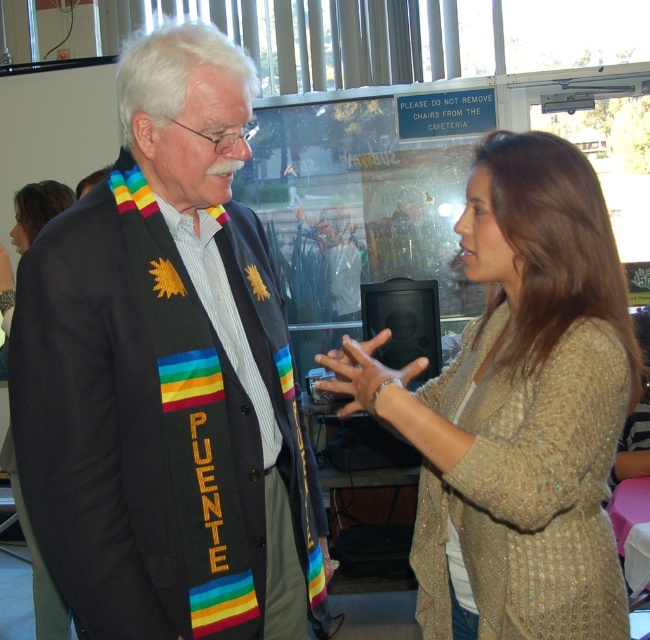
Question: Is sparkly beige cardigan at center to the right of shiny gold necklace at upper left from the viewer's perspective?

Choices:
 (A) no
 (B) yes

Answer: (B)

Question: Which object is farther from the camera taking this photo?

Choices:
 (A) sparkly beige cardigan at center
 (B) matte black suit at center

Answer: (B)

Question: Is the position of matte black suit at center more distant than that of sparkly beige cardigan at center?

Choices:
 (A) no
 (B) yes

Answer: (B)

Question: Does sparkly beige cardigan at center have a smaller size compared to shiny gold necklace at upper left?

Choices:
 (A) no
 (B) yes

Answer: (A)

Question: Among these objects, which one is nearest to the camera?

Choices:
 (A) shiny gold necklace at upper left
 (B) matte black suit at center

Answer: (B)

Question: Which object appears closest to the camera in this image?

Choices:
 (A) matte black suit at center
 (B) shiny gold necklace at upper left

Answer: (A)